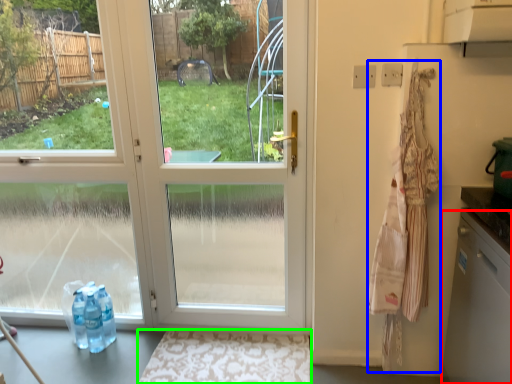
Question: Considering the real-world distances, which object is farthest from dish washer (highlighted by a red box)? laundry (highlighted by a blue box) or doormat (highlighted by a green box)?

Choices:
 (A) laundry
 (B) doormat

Answer: (B)